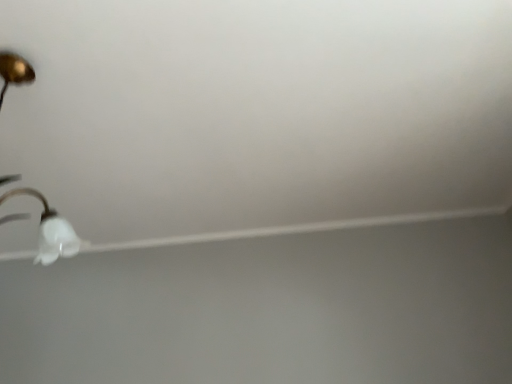
The height and width of the screenshot is (384, 512). What do you see at coordinates (50, 230) in the screenshot?
I see `white glossy lamp at upper left` at bounding box center [50, 230].

Measure the distance between white glossy lamp at upper left and camera.

white glossy lamp at upper left and camera are 2.05 meters apart.

Where is `white glossy lamp at upper left`? This screenshot has height=384, width=512. white glossy lamp at upper left is located at coordinates (50, 230).

Locate an element on the screen. white glossy lamp at upper left is located at coordinates click(50, 230).